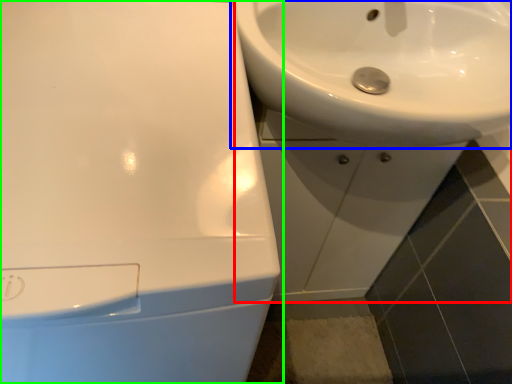
Question: Which object is the farthest from sink (highlighted by a red box)? Choose among these: sink (highlighted by a blue box) or sink (highlighted by a green box).

Choices:
 (A) sink
 (B) sink

Answer: (B)